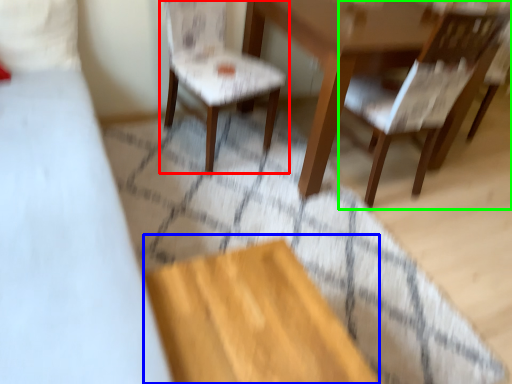
Question: Which is nearer to the chair (highlighted by a red box)? plywood (highlighted by a blue box) or chair (highlighted by a green box).

Choices:
 (A) plywood
 (B) chair

Answer: (B)